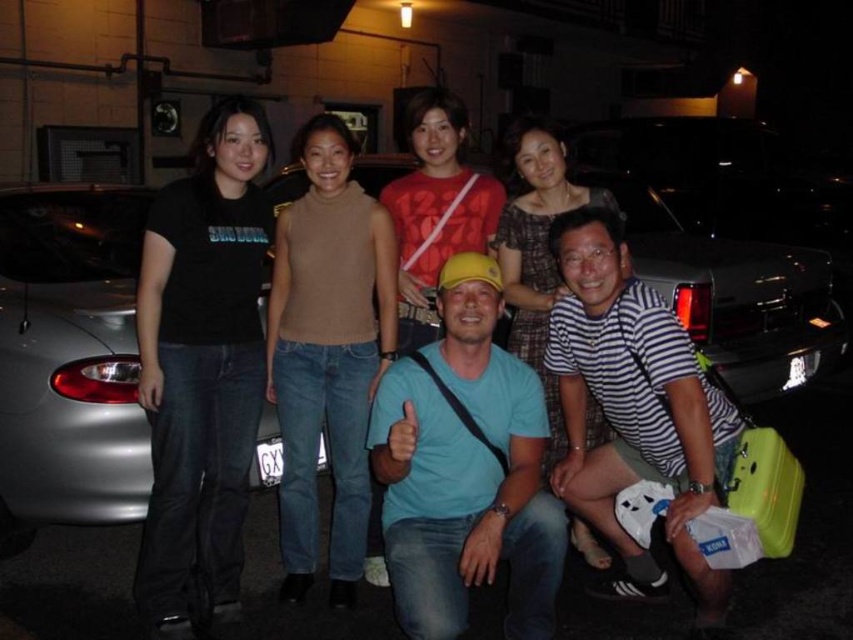
Question: Can you confirm if black cotton t-shirt at left is smaller than silver metallic car at left?

Choices:
 (A) yes
 (B) no

Answer: (A)

Question: Which object is farther from the camera taking this photo?

Choices:
 (A) knit beige sweater at center
 (B) black cotton t-shirt at left
 (C) silver metallic car at left

Answer: (C)

Question: Estimate the real-world distances between objects in this image. Which object is closer to the silver metallic car at left?

Choices:
 (A) knit beige sweater at center
 (B) black cotton t-shirt at left

Answer: (B)

Question: Estimate the real-world distances between objects in this image. Which object is farther from the knit beige sweater at center?

Choices:
 (A) silver metallic car at left
 (B) black cotton t-shirt at left

Answer: (A)

Question: Is black cotton t-shirt at left positioned in front of silver metallic car at left?

Choices:
 (A) yes
 (B) no

Answer: (A)

Question: Does black cotton t-shirt at left appear under knit beige sweater at center?

Choices:
 (A) yes
 (B) no

Answer: (B)